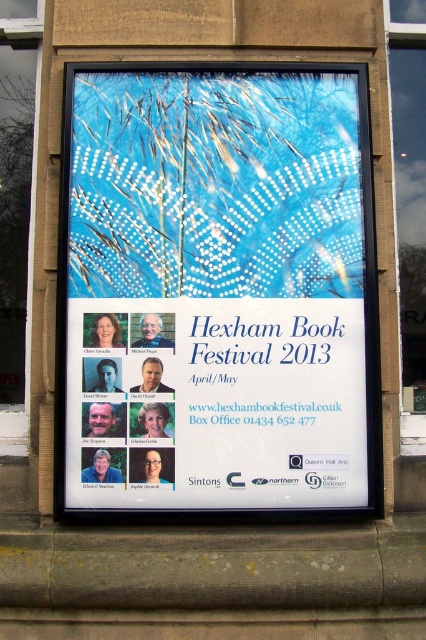
Can you confirm if blue paper poster at center is smaller than white paper poster at center?

Actually, blue paper poster at center might be larger than white paper poster at center.

Does point (192, 288) come in front of point (273, 317)?

No, (192, 288) is further to viewer.

This screenshot has width=426, height=640. Identify the location of blue paper poster at center. (215, 291).

Where is `transparent glass window at left`? This screenshot has width=426, height=640. transparent glass window at left is located at coordinates (17, 209).

Is transparent glass window at left wider than transparent glass window at center?

Yes.

What are the coordinates of `transparent glass window at left` in the screenshot? It's located at (17, 209).

Between blue paper poster at center and transparent glass window at center, which one appears on the right side from the viewer's perspective?

From the viewer's perspective, transparent glass window at center appears more on the right side.

Does blue paper poster at center appear on the left side of transparent glass window at center?

Yes, blue paper poster at center is to the left of transparent glass window at center.

Who is more distant from viewer, (152, 365) or (403, 189)?

Positioned behind is point (403, 189).

Find the location of a particular element. This screenshot has height=640, width=426. blue paper poster at center is located at coordinates (215, 291).